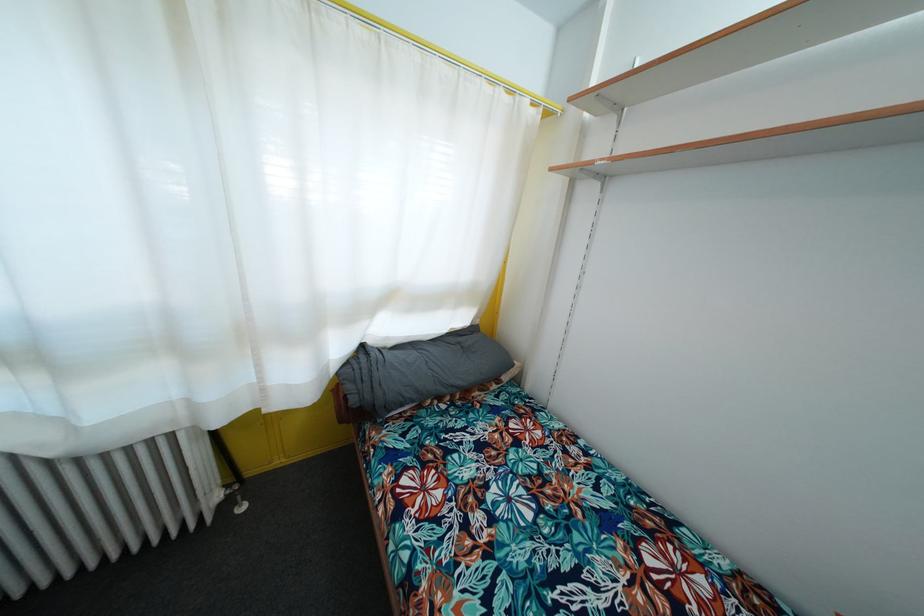
Describe the element at coordinates (233, 496) in the screenshot. I see `a radiator valve knob` at that location.